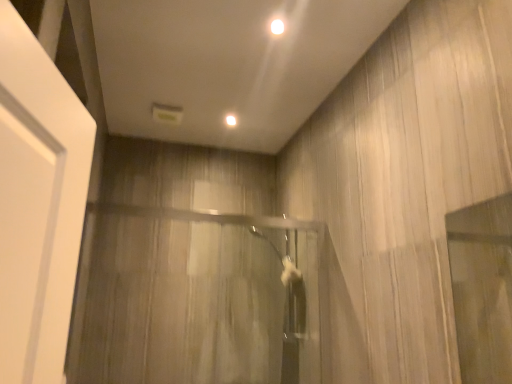
How much space does white glossy light at upper center, the first lighting when ordered from top to bottom, occupy vertically?

0.42 inches.

The image size is (512, 384). What do you see at coordinates (202, 299) in the screenshot?
I see `clear glass shower door at center` at bounding box center [202, 299].

What is the approximate height of white glossy light at upper center, marked as the 2th lighting in a front-to-back arrangement?

It is 0.60 inches.

You are a GUI agent. You are given a task and a screenshot of the screen. Output one action in this format:
    pyautogui.click(x=<x>, y=<y>)
    Task: Click on the white glossy light at upper center, placed as the 2th lighting when sorted from left to right
    The height and width of the screenshot is (384, 512).
    Given the screenshot: What is the action you would take?
    pyautogui.click(x=277, y=27)

Considering the sizes of objects clear glass shower door at center and white glossy light at upper center, the 1th lighting when ordered from right to left, in the image provided, who is wider, clear glass shower door at center or white glossy light at upper center, the 1th lighting when ordered from right to left,?

With larger width is white glossy light at upper center, the 1th lighting when ordered from right to left.

Consider the image. Does clear glass shower door at center turn towards white glossy light at upper center, the 1th lighting when ordered from right to left?

No, clear glass shower door at center is not facing towards white glossy light at upper center, the 1th lighting when ordered from right to left.

Which is in front, point (316, 223) or point (278, 21)?

The point (278, 21) is more forward.

Is clear glass shower door at center shorter than white glossy light at upper center, which is the 1th lighting in front-to-back order?

No, clear glass shower door at center is not shorter than white glossy light at upper center, which is the 1th lighting in front-to-back order.

From a real-world perspective, which is physically below, white glossy light at upper center, the first lighting when ordered from top to bottom, or white glossy light at upper center, which ranks as the first lighting in left-to-right order?

white glossy light at upper center, the first lighting when ordered from top to bottom.

Can we say white glossy light at upper center, the first lighting when ordered from top to bottom, lies outside white glossy light at upper center, marked as the second lighting in a right-to-left arrangement?

Yes, white glossy light at upper center, the first lighting when ordered from top to bottom, is outside of white glossy light at upper center, marked as the second lighting in a right-to-left arrangement.

Considering the sizes of objects white glossy light at upper center, placed as the 2th lighting when sorted from left to right, and white glossy light at upper center, the second lighting positioned from the top, in the image provided, who is shorter, white glossy light at upper center, placed as the 2th lighting when sorted from left to right, or white glossy light at upper center, the second lighting positioned from the top,?

white glossy light at upper center, placed as the 2th lighting when sorted from left to right, is shorter.

Does white glossy light at upper center, marked as the 2th lighting in a front-to-back arrangement, have a larger size compared to white glossy light at upper center, marked as the second lighting in a bottom-to-top arrangement?

Yes.

Which is farther, (234, 117) or (277, 21)?

The point (234, 117) is behind.

Which object is closer to the camera taking this photo, white glossy light at upper center, marked as the 1th lighting in a bottom-to-top arrangement, or white glossy light at upper center, marked as the second lighting in a bottom-to-top arrangement?

Positioned in front is white glossy light at upper center, marked as the second lighting in a bottom-to-top arrangement.

Does white glossy light at upper center, placed as the 2th lighting when sorted from left to right, lie in front of clear glass shower door at center?

No.

This screenshot has width=512, height=384. I want to click on screen door directly beneath the white glossy light at upper center, the first lighting when ordered from top to bottom (from a real-world perspective), so click(x=202, y=299).

Is white glossy light at upper center, the first lighting when ordered from top to bottom, facing away from clear glass shower door at center?

No, clear glass shower door at center is not at the back of white glossy light at upper center, the first lighting when ordered from top to bottom.

Is white glossy light at upper center, placed as the 2th lighting when sorted from left to right, in contact with clear glass shower door at center?

No, white glossy light at upper center, placed as the 2th lighting when sorted from left to right, is not touching clear glass shower door at center.

Who is smaller, white glossy light at upper center, marked as the 1th lighting in a bottom-to-top arrangement, or clear glass shower door at center?

With smaller size is white glossy light at upper center, marked as the 1th lighting in a bottom-to-top arrangement.

Is white glossy light at upper center, the second lighting positioned from the top, at the left side of clear glass shower door at center?

Incorrect, white glossy light at upper center, the second lighting positioned from the top, is not on the left side of clear glass shower door at center.

From the image's perspective, is white glossy light at upper center, marked as the 2th lighting in a front-to-back arrangement, over clear glass shower door at center?

Correct, white glossy light at upper center, marked as the 2th lighting in a front-to-back arrangement, appears higher than clear glass shower door at center in the image.

Is clear glass shower door at center further to camera compared to white glossy light at upper center, which appears as the first lighting when viewed from the back?

No, clear glass shower door at center is closer to the camera.

Does clear glass shower door at center contain white glossy light at upper center, marked as the 1th lighting in a bottom-to-top arrangement?

No, white glossy light at upper center, marked as the 1th lighting in a bottom-to-top arrangement, is not surrounded by clear glass shower door at center.

Is clear glass shower door at center not close to white glossy light at upper center, which ranks as the first lighting in left-to-right order?

Indeed, clear glass shower door at center is not near white glossy light at upper center, which ranks as the first lighting in left-to-right order.

Can you confirm if clear glass shower door at center is positioned to the right of white glossy light at upper center, which appears as the first lighting when viewed from the back?

No.

Find the location of a particular element. This screenshot has width=512, height=384. screen door below the white glossy light at upper center, the second lighting in the back-to-front sequence (from a real-world perspective) is located at coordinates (202, 299).

Where is `lighting that is above the white glossy light at upper center, the first lighting when ordered from top to bottom (from a real-world perspective)`? lighting that is above the white glossy light at upper center, the first lighting when ordered from top to bottom (from a real-world perspective) is located at coordinates (231, 120).

From the image, which object appears to be farther from clear glass shower door at center, white glossy light at upper center, marked as the second lighting in a bottom-to-top arrangement, or white glossy light at upper center, marked as the 2th lighting in a front-to-back arrangement?

The object further to clear glass shower door at center is white glossy light at upper center, marked as the second lighting in a bottom-to-top arrangement.

From the image, which object appears to be farther from clear glass shower door at center, white glossy light at upper center, which appears as the first lighting when viewed from the back, or white glossy light at upper center, placed as the 2th lighting when sorted from left to right?

Among the two, white glossy light at upper center, placed as the 2th lighting when sorted from left to right, is located further to clear glass shower door at center.

Considering their positions, is clear glass shower door at center positioned closer to white glossy light at upper center, the 1th lighting when ordered from right to left, than white glossy light at upper center, marked as the 1th lighting in a bottom-to-top arrangement?

The object closer to white glossy light at upper center, the 1th lighting when ordered from right to left, is white glossy light at upper center, marked as the 1th lighting in a bottom-to-top arrangement.

Based on the photo, based on their spatial positions, is clear glass shower door at center or white glossy light at upper center, the second lighting in the back-to-front sequence, further from white glossy light at upper center, marked as the 2th lighting in a front-to-back arrangement?

clear glass shower door at center.

Estimate the real-world distances between objects in this image. Which object is closer to white glossy light at upper center, marked as the 1th lighting in a bottom-to-top arrangement, white glossy light at upper center, the first lighting when ordered from top to bottom, or clear glass shower door at center?

white glossy light at upper center, the first lighting when ordered from top to bottom, is positioned closer to the anchor white glossy light at upper center, marked as the 1th lighting in a bottom-to-top arrangement.

Which object lies nearer to the anchor point white glossy light at upper center, marked as the second lighting in a bottom-to-top arrangement, white glossy light at upper center, the second lighting positioned from the top, or clear glass shower door at center?

white glossy light at upper center, the second lighting positioned from the top, lies closer to white glossy light at upper center, marked as the second lighting in a bottom-to-top arrangement, than the other object.

Image resolution: width=512 pixels, height=384 pixels. I want to click on lighting between white glossy light at upper center, the second lighting in the back-to-front sequence, and clear glass shower door at center, in the vertical direction, so click(x=231, y=120).